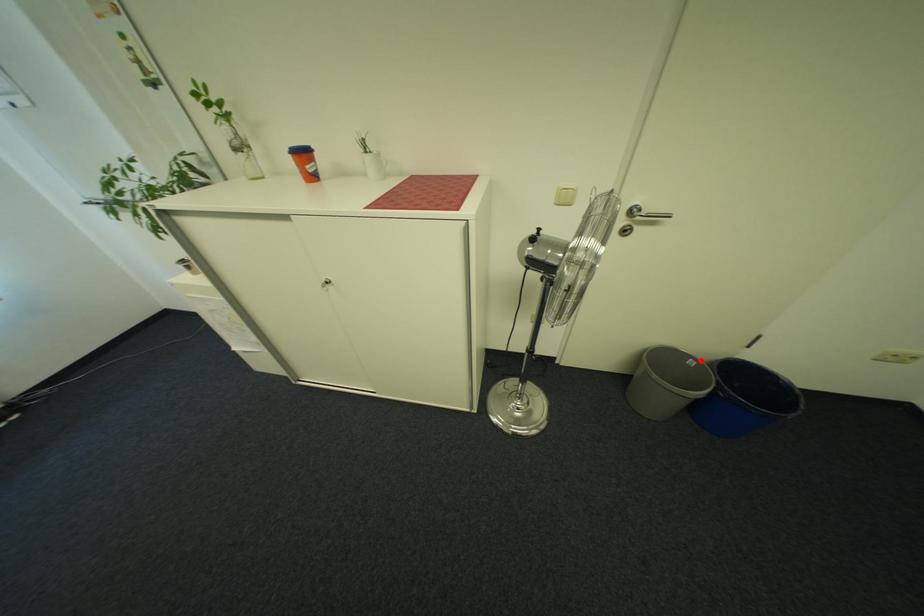
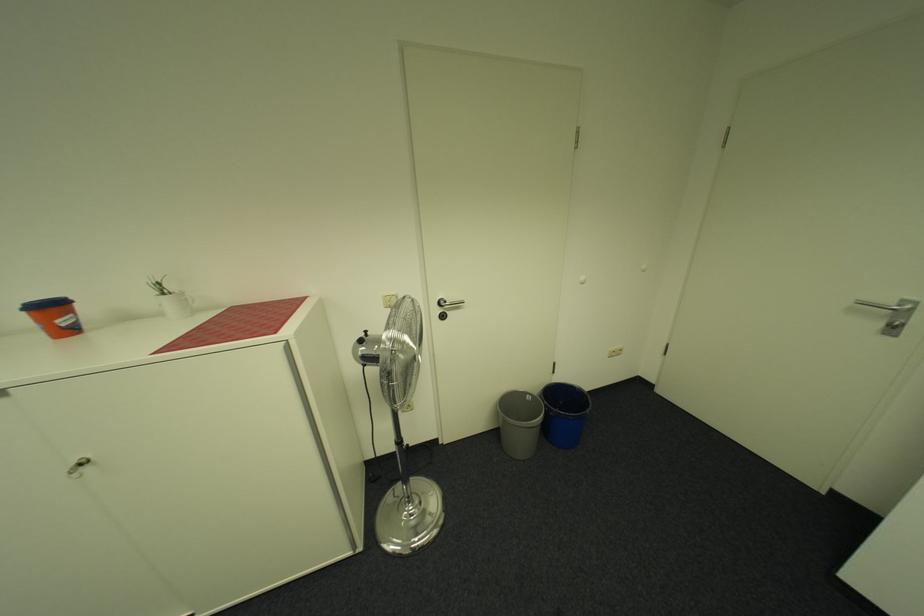
The point at the highlighted location is marked in the first image. Where is the corresponding point in the second image?

(538, 397)